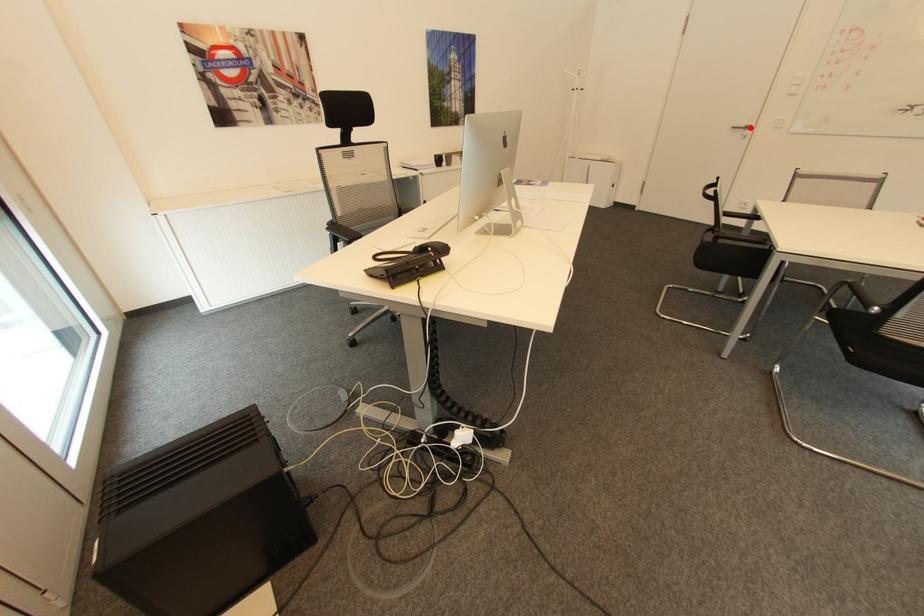
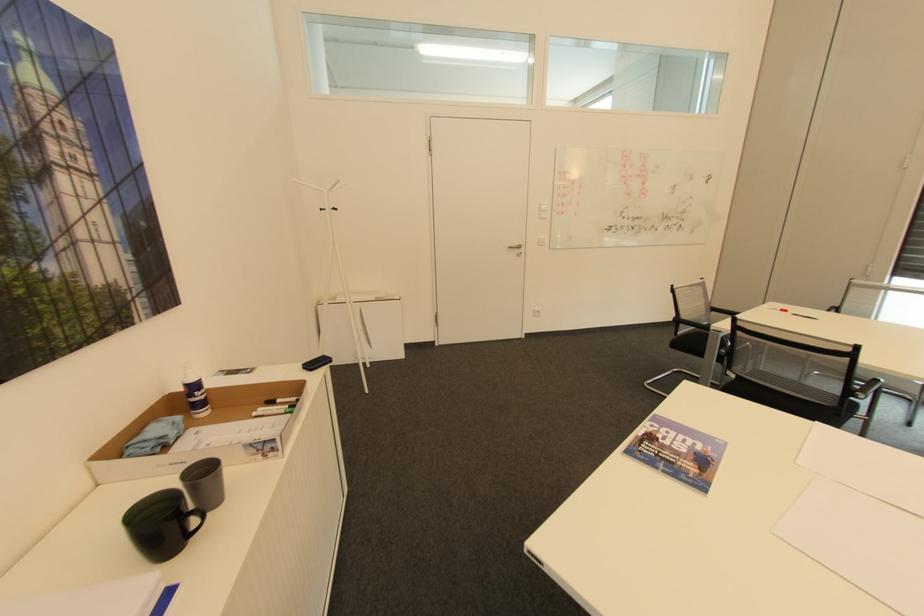
Where in the second image is the point corresponding to the highlighted location from the first image?

(524, 246)